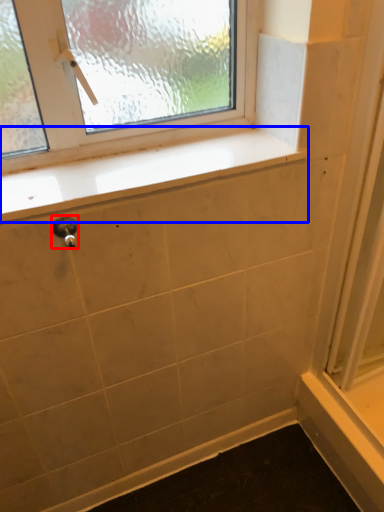
Question: Among these objects, which one is nearest to the camera, door handle (highlighted by a red box) or window sill (highlighted by a blue box)?

Choices:
 (A) door handle
 (B) window sill

Answer: (A)